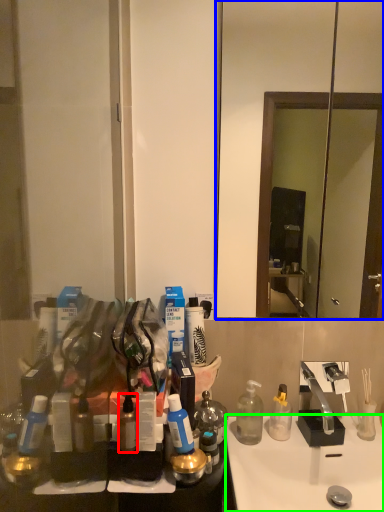
Question: Which object is positioned closest to bottle (highlighted by a red box)? Select from mirror (highlighted by a blue box) and sink (highlighted by a green box).

Choices:
 (A) mirror
 (B) sink

Answer: (B)